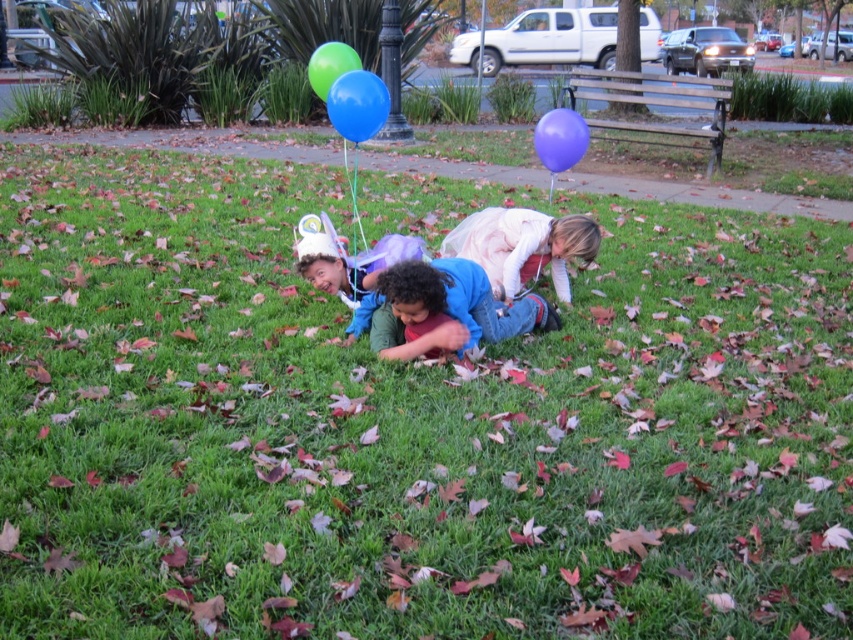
Is light pink fabric dress at center to the right of matte purple balloon at upper right from the viewer's perspective?

Incorrect, light pink fabric dress at center is not on the right side of matte purple balloon at upper right.

Is point (515, 280) more distant than point (576, 140)?

No, (515, 280) is in front of (576, 140).

The height and width of the screenshot is (640, 853). In order to click on light pink fabric dress at center in this screenshot , I will do `click(521, 246)`.

Measure the distance between light pink fabric dress at center and blue rubber balloon at center.

The distance of light pink fabric dress at center from blue rubber balloon at center is 3.95 feet.

Based on the photo, which is more to the right, light pink fabric dress at center or blue rubber balloon at center?

From the viewer's perspective, light pink fabric dress at center appears more on the right side.

Which is behind, point (550, 268) or point (357, 122)?

The point (550, 268) is behind.

At what (x,y) coordinates should I click in order to perform the action: click on light pink fabric dress at center. Please return your answer as a coordinate pair (x, y). The image size is (853, 640). Looking at the image, I should click on (521, 246).

Who is more distant from viewer, (453,273) or (322,58)?

Point (322,58)

Find the location of `blue denim jeans at center`. blue denim jeans at center is located at coordinates (445, 310).